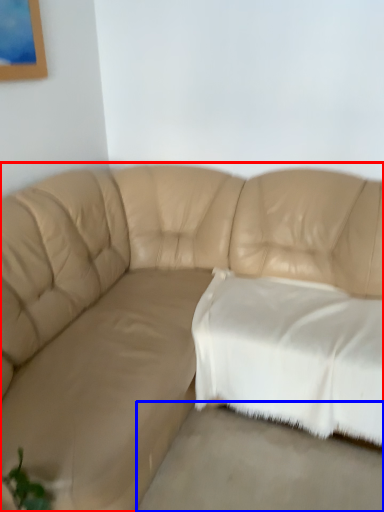
Question: Which object is closer to the camera taking this photo, studio couch (highlighted by a red box) or concrete (highlighted by a blue box)?

Choices:
 (A) studio couch
 (B) concrete

Answer: (A)